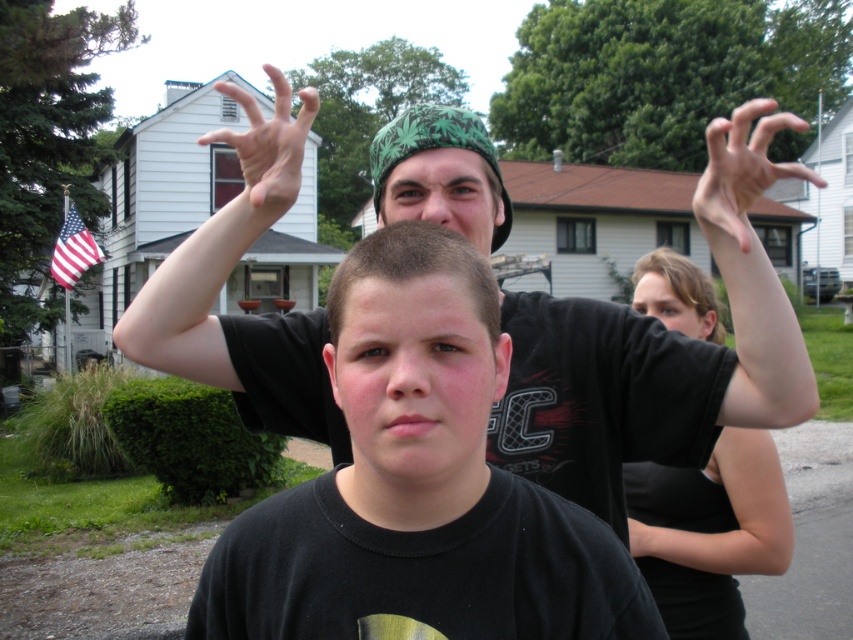
Does black matte shirt at upper center have a smaller size compared to matte black hand at upper center?

Correct, black matte shirt at upper center occupies less space than matte black hand at upper center.

Based on the photo, can you confirm if black matte shirt at upper center is bigger than matte black hand at upper center?

No.

Does point (258, 323) come closer to viewer compared to point (233, 204)?

No, (258, 323) is behind (233, 204).

Find the location of a particular element. black matte shirt at upper center is located at coordinates (657, 349).

Between pinkish skin tone hand at upper right and brown hair at upper center, which one is positioned higher?

pinkish skin tone hand at upper right

Is point (740, 218) positioned before point (705, 324)?

Yes.

The width and height of the screenshot is (853, 640). What are the coordinates of `pinkish skin tone hand at upper right` in the screenshot? It's located at (741, 173).

Does black matte head at center have a lesser width compared to green fabric cap at center?

Yes.

Is point (399, 241) less distant than point (485, 156)?

Yes, point (399, 241) is closer to viewer.

The image size is (853, 640). Describe the element at coordinates (415, 268) in the screenshot. I see `black matte head at center` at that location.

Locate an element on the screen. black matte head at center is located at coordinates point(415,268).